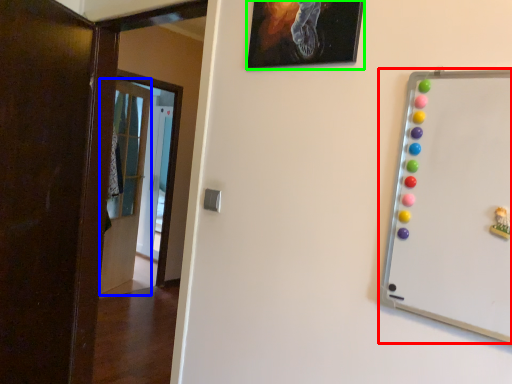
Question: Which is farther away from whiteboard (highlighted by a red box)? door (highlighted by a blue box) or picture frame (highlighted by a green box)?

Choices:
 (A) door
 (B) picture frame

Answer: (A)